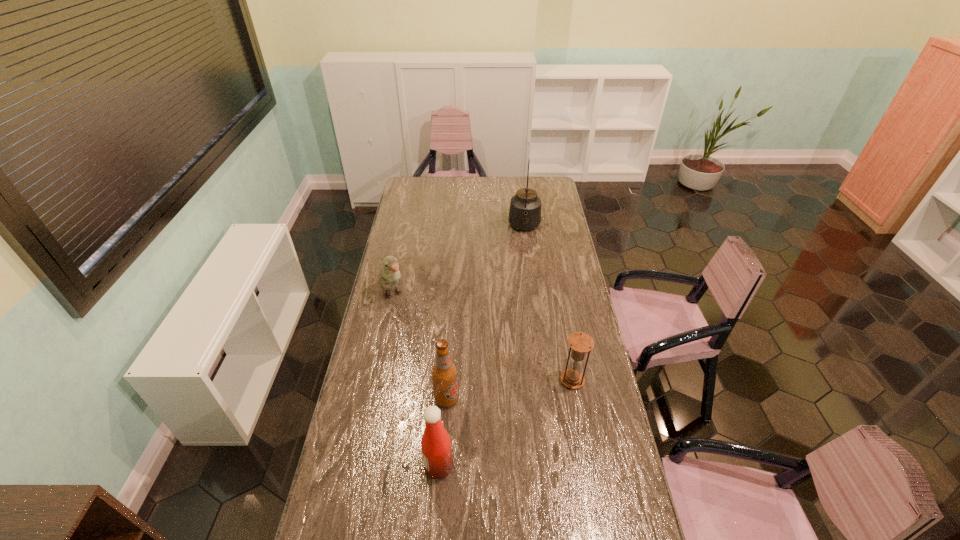
The height and width of the screenshot is (540, 960). I want to click on vacant space on the desktop that is between the condiment and the hourglass and is positioned on the front label of the beer bottle, so click(493, 431).

Locate an element on the screen. free space on the desktop that is between the condiment and the hourglass and is positioned spout on the farthest object is located at coordinates (516, 416).

This screenshot has height=540, width=960. Find the location of `free space on the desktop that is between the nearest object and the hourglass and is positioned at the face of the second farthest object`. free space on the desktop that is between the nearest object and the hourglass and is positioned at the face of the second farthest object is located at coordinates (494, 430).